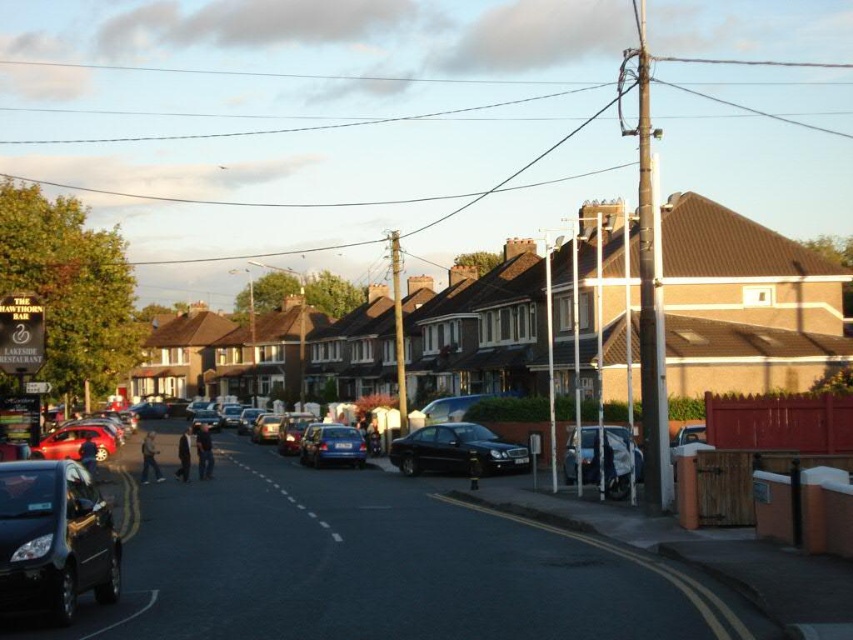
Question: Which of the following is the farthest from the observer?

Choices:
 (A) metallic silver car at center-right
 (B) metallic silver car at center
 (C) metallic blue sedan at center
 (D) brown brick houses at center

Answer: (B)

Question: Which point appears farthest from the camera in this image?

Choices:
 (A) (53, 554)
 (B) (389, 445)
 (C) (613, 449)

Answer: (B)

Question: Does metallic silver car at center-right lie in front of metallic blue sedan at center?

Choices:
 (A) no
 (B) yes

Answer: (B)

Question: Which object appears closest to the camera in this image?

Choices:
 (A) shiny black sedan at center
 (B) metallic blue sedan at center
 (C) brown brick houses at center

Answer: (C)

Question: Is shiny black car at lower left closer to the viewer compared to metallic blue sedan at center?

Choices:
 (A) no
 (B) yes

Answer: (B)

Question: Is metallic blue sedan at center below metallic silver car at center?

Choices:
 (A) yes
 (B) no

Answer: (B)